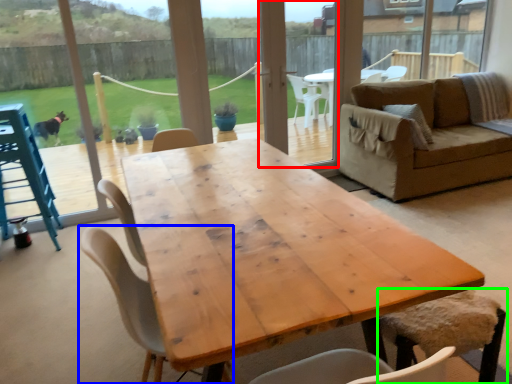
Question: Which is farther away from screen door (highlighted by a red box)? chair (highlighted by a blue box) or chair (highlighted by a green box)?

Choices:
 (A) chair
 (B) chair

Answer: (A)